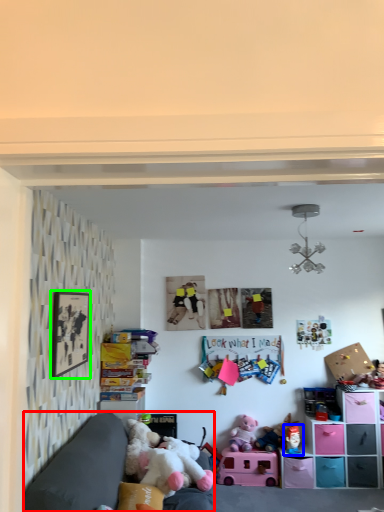
Question: Based on their relative distances, which object is farther from studio couch (highlighted by a red box)? Choose from toy (highlighted by a blue box) and picture frame (highlighted by a green box).

Choices:
 (A) toy
 (B) picture frame

Answer: (A)